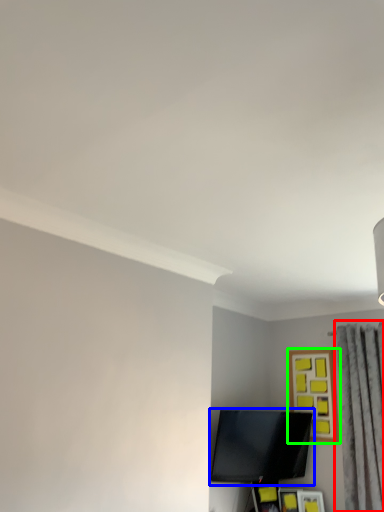
Question: Considering the real-world distances, which object is closest to curtain (highlighted by a red box)? television (highlighted by a blue box) or picture frame (highlighted by a green box).

Choices:
 (A) television
 (B) picture frame

Answer: (B)